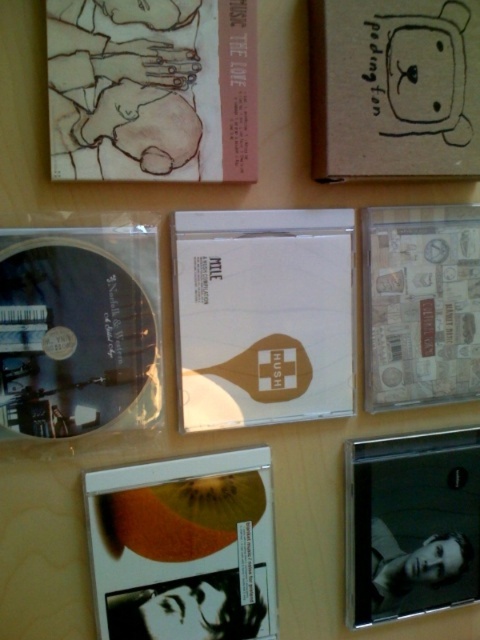
Is brown cardboard book at upper right thinner than wooden cd case at right?

No.

Between brown cardboard book at upper right and wooden cd case at right, which one has more height?

Standing taller between the two is wooden cd case at right.

Locate an element on the screen. brown cardboard book at upper right is located at coordinates (395, 88).

Can you confirm if transparent plastic cd at upper left is thinner than brown cardboard book at upper right?

Yes, transparent plastic cd at upper left is thinner than brown cardboard book at upper right.

Does transparent plastic cd at upper left have a greater height compared to brown cardboard book at upper right?

Correct, transparent plastic cd at upper left is much taller as brown cardboard book at upper right.

Where is `transparent plastic cd at upper left`? This screenshot has height=640, width=480. transparent plastic cd at upper left is located at coordinates (79, 330).

Can you confirm if matte black album at upper left is shorter than transparent plastic cd at upper left?

Yes.

Can you confirm if matte black album at upper left is positioned above transparent plastic cd at upper left?

Yes, matte black album at upper left is above transparent plastic cd at upper left.

This screenshot has height=640, width=480. I want to click on matte black album at upper left, so click(x=152, y=90).